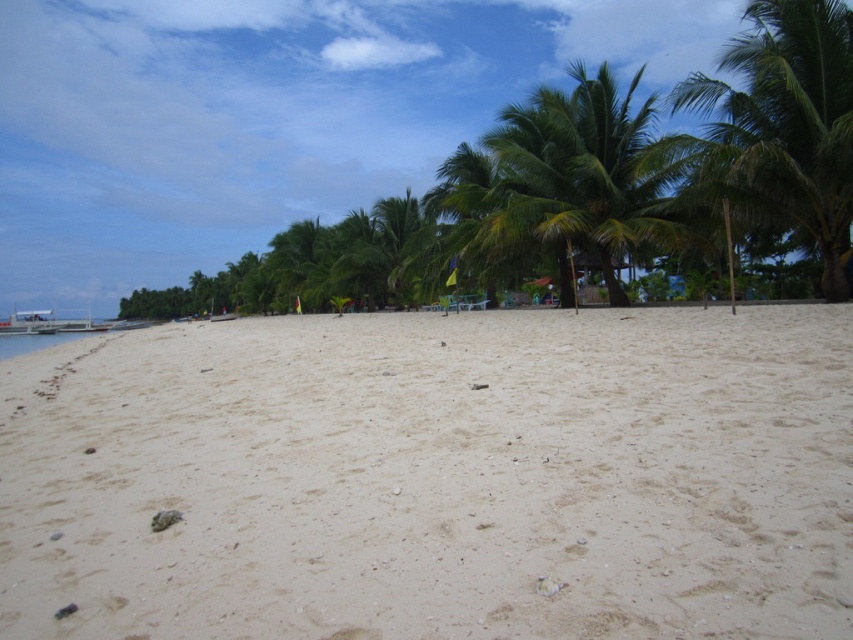
You are standing on the beach and want to take a photo of the green leafy palm tree at right. If you need to be at least 50 feet away to capture the entire tree in the frame, will you need to move further back?

The green leafy palm tree at right is 49.17 feet away from viewer, so you need to move back approximately 0.83 feet to be at least 50 feet away to capture the entire tree in the frame.

You are standing on the white sandy beach at center and want to walk towards the green leafy palm tree at upper right. Which direction should you move to get closer to the palm tree?

You should move towards the upper right direction to get closer to the green leafy palm tree at upper right since it is located in that direction and the white sandy beach at center is in front of it.